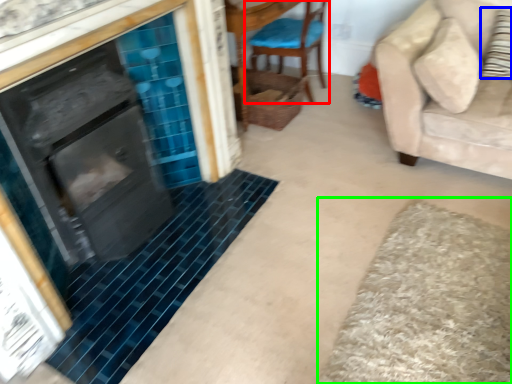
Question: Which is nearer to the chair (highlighted by a red box)? pillow (highlighted by a blue box) or bath mat (highlighted by a green box).

Choices:
 (A) pillow
 (B) bath mat

Answer: (A)